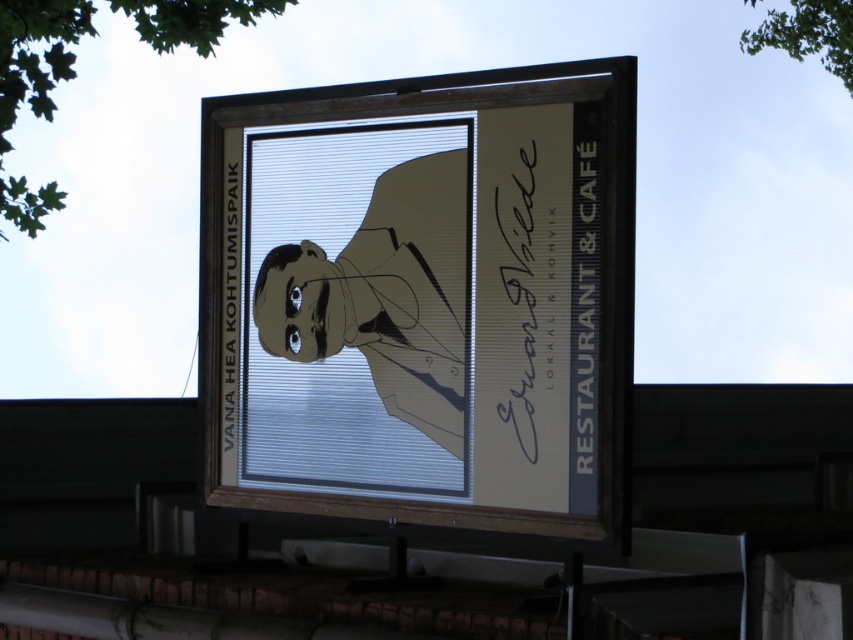
You are a delivery person trying to read the text on the black paper at left behind the matte beige signboard at center. Can you see the text clearly?

The matte beige signboard at center is in front of the black paper at left, so the black paper at left is blocked by the signboard and the text cannot be seen clearly.

You are a delivery person trying to attach a package to the matte beige signboard at center and the black paper at left. Since you can only attach it to the object that is on the right side, which one should you choose?

You should choose the matte beige signboard at center because it is located to the right of the black paper at left, making it the correct object for attachment on the right side.

You are a delivery person who needs to place a 60 cm wide package between the matte beige signboard at center and the black paper at right. Can you fit the package in the space between them?

The distance between the matte beige signboard at center and the black paper at right is 59.25 centimeters, so the 60 cm wide package cannot fit in the space between them as it is slightly wider than the available space.